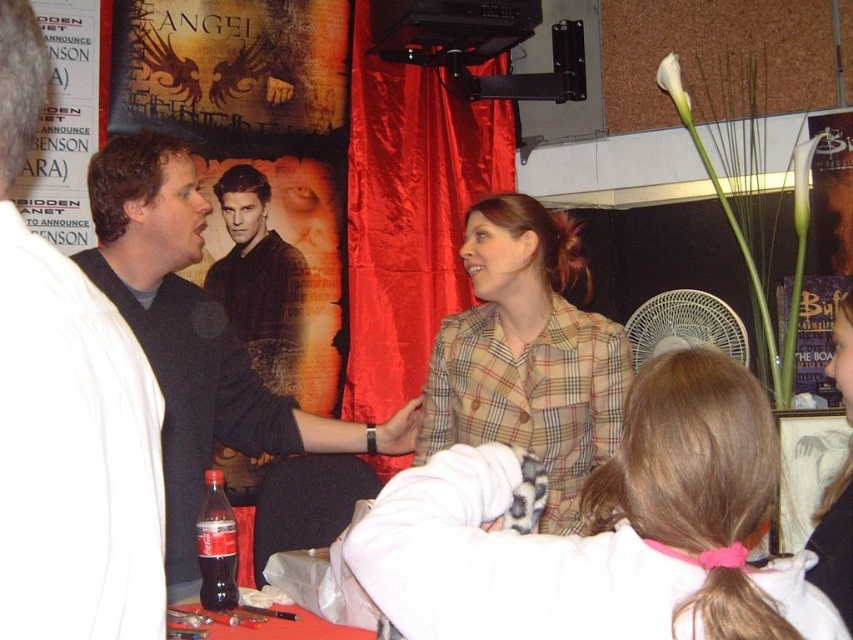
You are attending the Angel TV show convention and notice two jackets displayed at the promotional booth. The dark brown leather jacket at upper left and the plaid fabric jacket at center. Which jacket takes up more space in the image?

The plaid fabric jacket at center takes up more space in the image because it is larger than the dark brown leather jacket at upper left.

You are attending a convention and notice two people near the promotional table for the TV show Angel. You see the dark brown leather jacket at upper left and the matte black shirt at left. Which person is positioned more to the right?

The dark brown leather jacket at upper left is positioned more to the right than the matte black shirt at left.